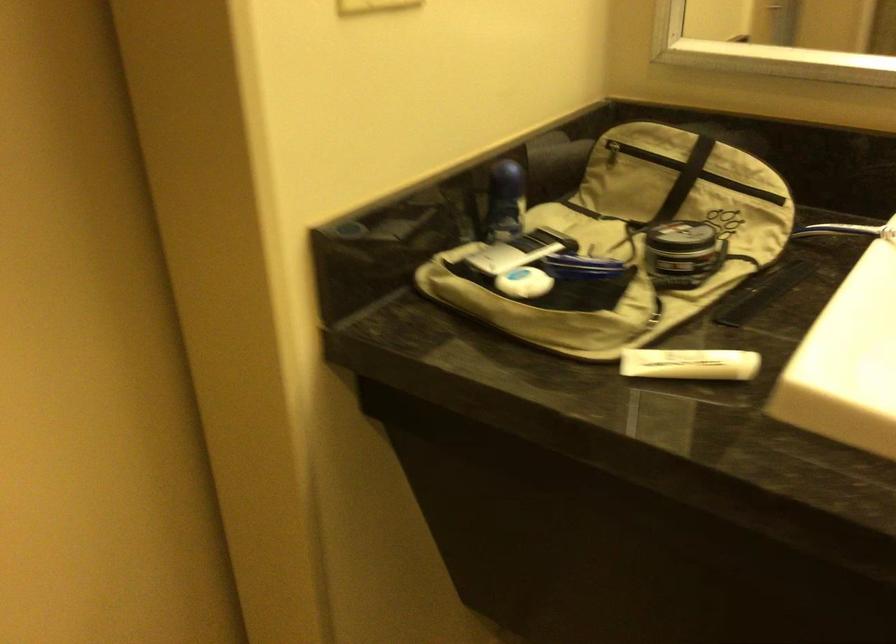
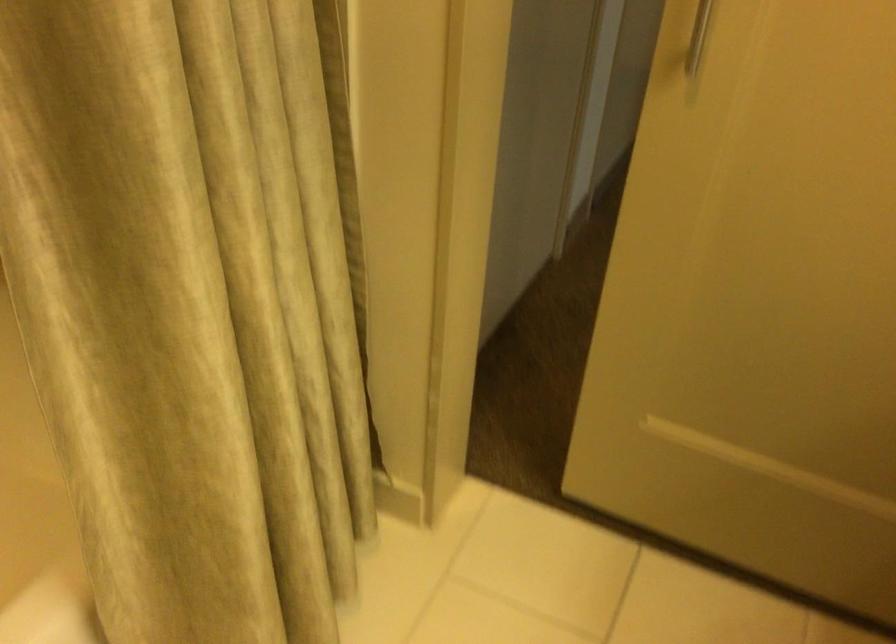
The first image is from the beginning of the video and the second image is from the end. How did the camera likely rotate when shooting the video?

The rotation direction of the camera is left-down.